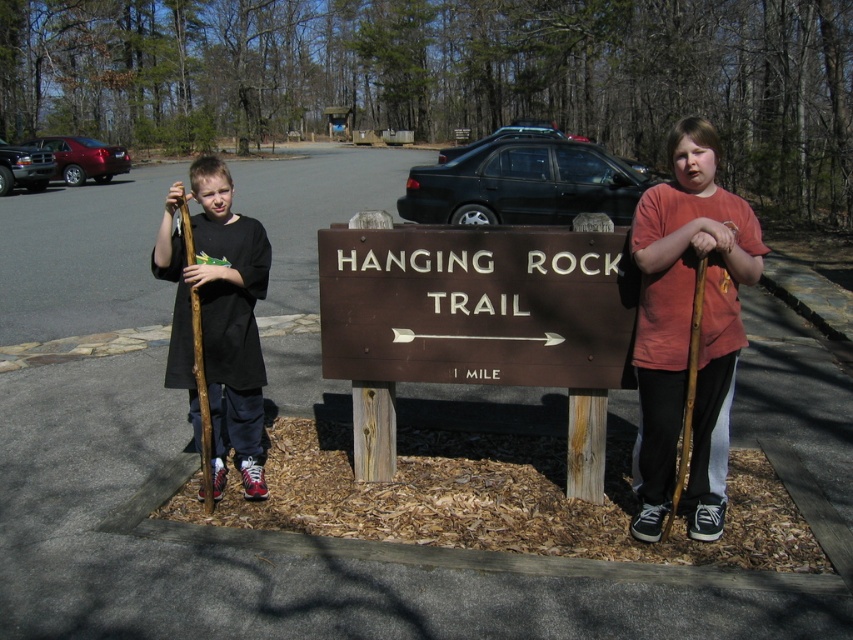
Who is taller, brown wooden sign at center or wooden stick at right?

wooden stick at right is taller.

Who is shorter, brown wooden sign at center or wooden stick at right?

Standing shorter between the two is brown wooden sign at center.

Where is `brown wooden sign at center`? brown wooden sign at center is located at coordinates (477, 305).

Can you confirm if brown wooden sign at center is thinner than matte black shirt at left?

Incorrect, brown wooden sign at center's width is not less than matte black shirt at left's.

Looking at this image, who is more forward, (444, 326) or (209, 186)?

Positioned in front is point (444, 326).

At what (x,y) coordinates should I click in order to perform the action: click on brown wooden sign at center. Please return your answer as a coordinate pair (x, y). Looking at the image, I should click on (477, 305).

Can you confirm if wooden stick at right is thinner than brown rough wooden stick at left?

No, wooden stick at right is not thinner than brown rough wooden stick at left.

Which is more to the right, wooden stick at right or brown rough wooden stick at left?

wooden stick at right is more to the right.

Is point (712, 525) closer to camera compared to point (180, 224)?

Yes, point (712, 525) is closer to viewer.

What are the coordinates of `wooden stick at right` in the screenshot? It's located at 688,326.